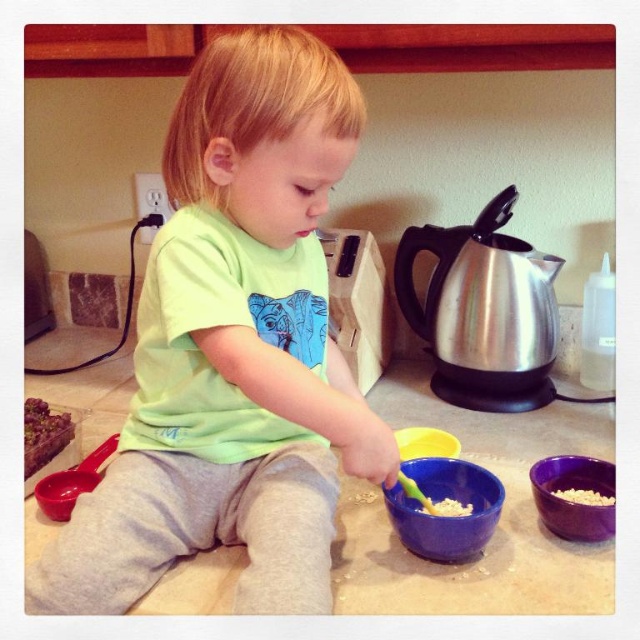
Question: Does stainless steel kettle at right have a greater width compared to smooth chocolate cake at lower left?

Choices:
 (A) no
 (B) yes

Answer: (B)

Question: Which object is farther from the camera taking this photo?

Choices:
 (A) white crumbly food at lower right
 (B) stainless steel kettle at right
 (C) green matte shirt at center

Answer: (B)

Question: Considering the relative positions of smooth chocolate cake at lower left and red plastic spoon at lower left in the image provided, where is smooth chocolate cake at lower left located with respect to red plastic spoon at lower left?

Choices:
 (A) left
 (B) right

Answer: (A)

Question: Which of these objects is positioned farthest from the stainless steel kettle at right?

Choices:
 (A) red plastic spoon at lower left
 (B) smooth chocolate cake at lower left
 (C) green matte shirt at center

Answer: (B)

Question: Is purple glossy bowl at lower right further to camera compared to white crumbly food at bowl center?

Choices:
 (A) yes
 (B) no

Answer: (B)

Question: Among these objects, which one is farthest from the camera?

Choices:
 (A) purple glossy bowl at lower right
 (B) white crumbly food at bowl center
 (C) blue matte bowl at center

Answer: (B)